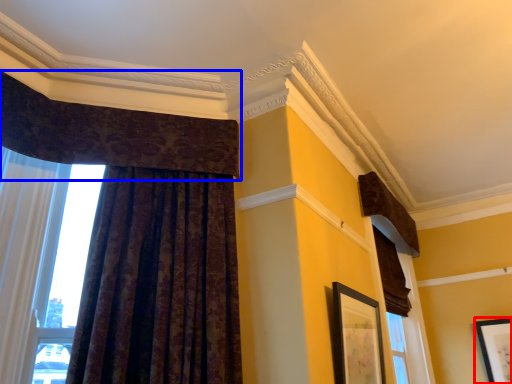
Question: Which object appears farthest to the camera in this image, picture frame (highlighted by a red box) or curtain (highlighted by a blue box)?

Choices:
 (A) picture frame
 (B) curtain

Answer: (A)